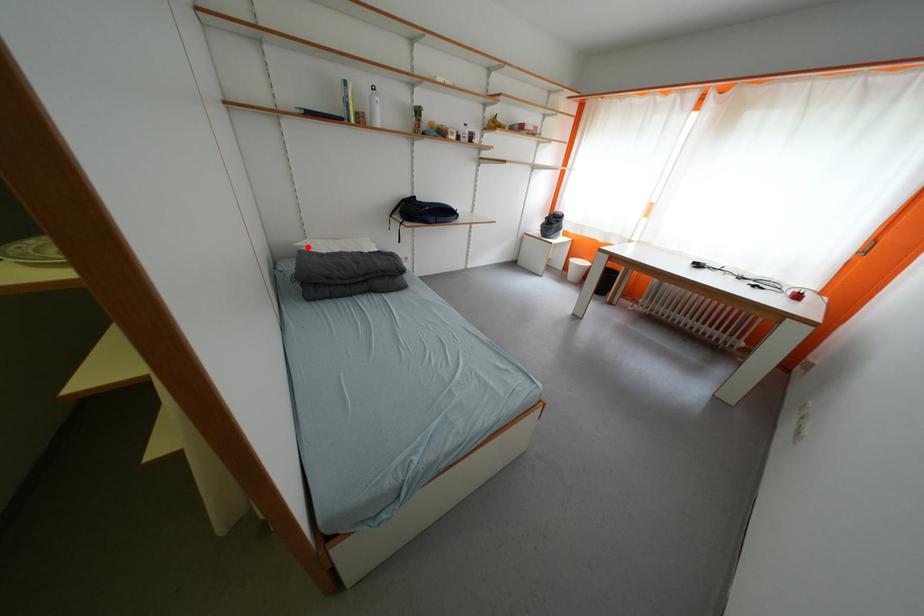
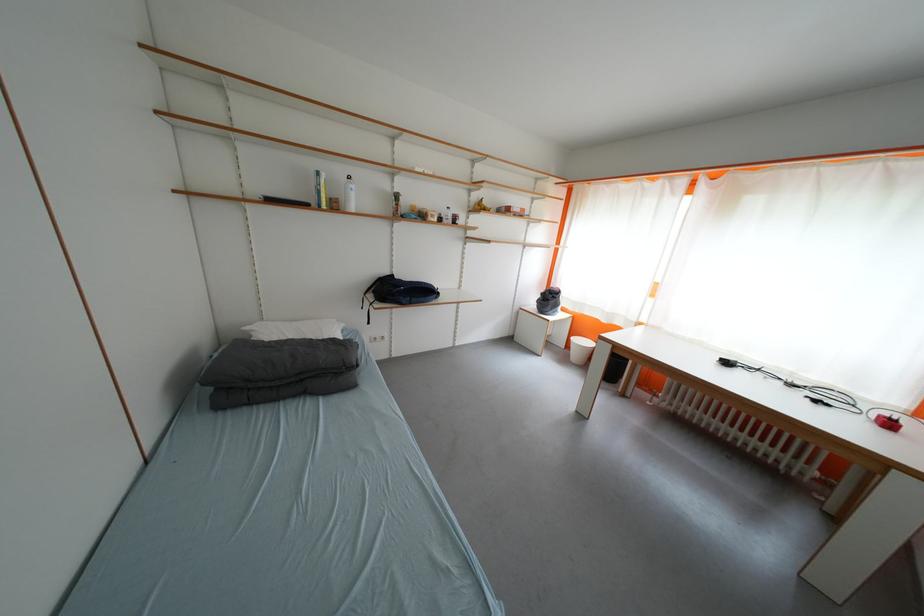
Where in the second image is the point corresponding to the highlighted location from the first image?

(257, 331)